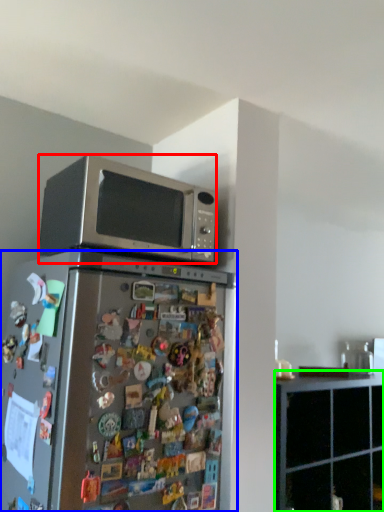
Question: Which object is positioned farthest from microwave oven (highlighted by a red box)? Select from refrigerator (highlighted by a blue box) and cabinetry (highlighted by a green box).

Choices:
 (A) refrigerator
 (B) cabinetry

Answer: (B)